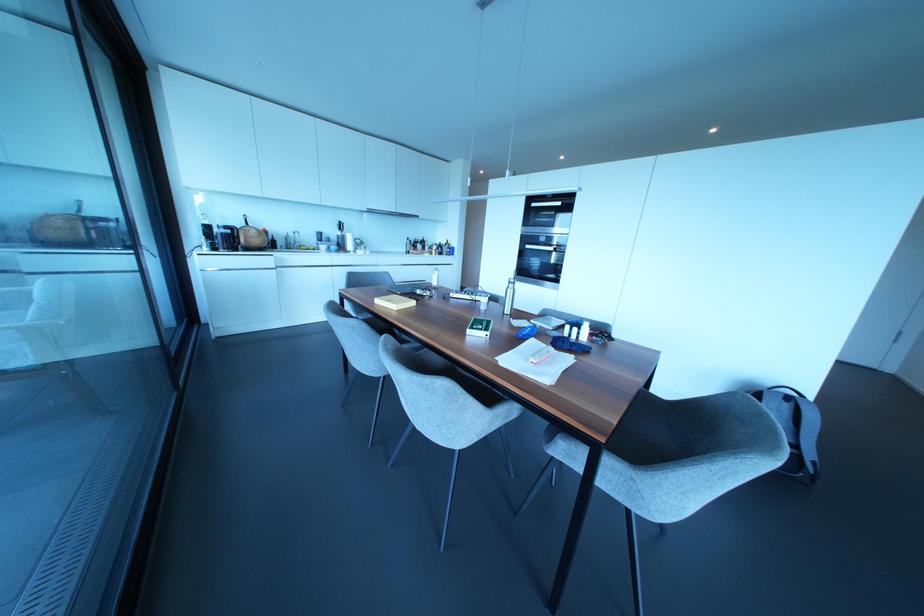
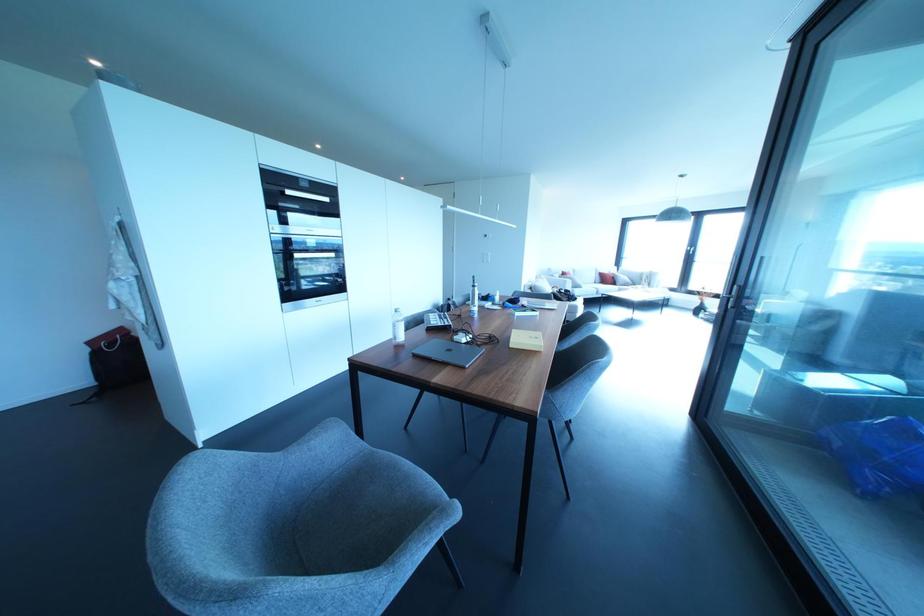
Find the pixel in the second image that matches pixel 553 248 in the first image.

(332, 254)